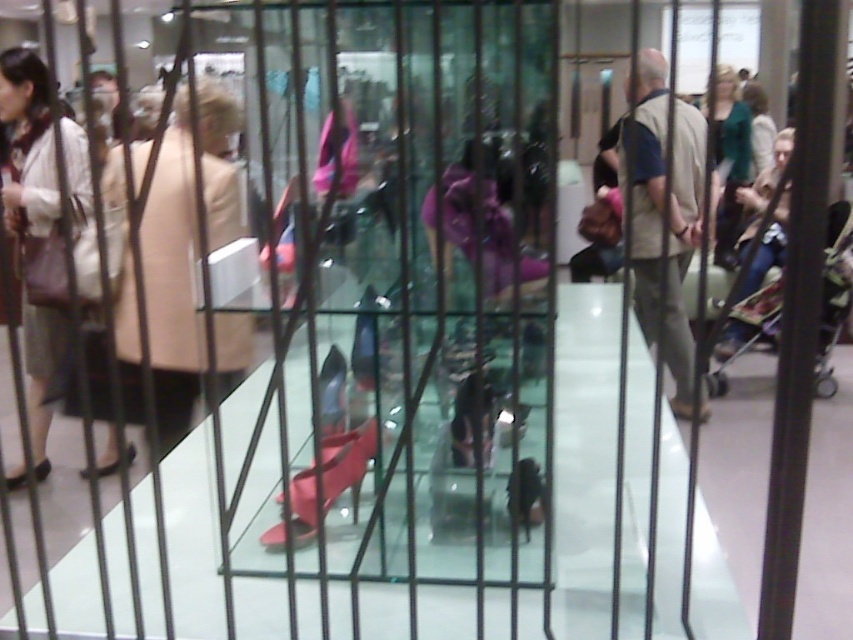
Question: Considering the relative positions of matte beige coat at left and matte green sweater at upper right in the image provided, where is matte beige coat at left located with respect to matte green sweater at upper right?

Choices:
 (A) left
 (B) right

Answer: (A)

Question: Which point is closer to the camera?

Choices:
 (A) (50, 394)
 (B) (735, 115)

Answer: (A)

Question: Which point appears farthest from the camera in this image?

Choices:
 (A) (732, 257)
 (B) (33, 100)

Answer: (A)

Question: Can you confirm if matte beige coat at left is positioned above matte green sweater at upper right?

Choices:
 (A) no
 (B) yes

Answer: (A)

Question: Can you confirm if matte beige coat at left is positioned to the left of matte green sweater at upper right?

Choices:
 (A) no
 (B) yes

Answer: (B)